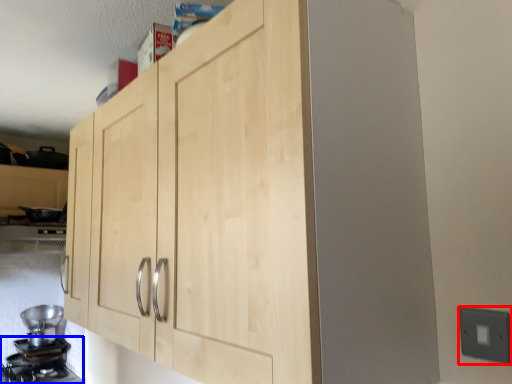
Question: Which of the following is the farthest to the observer, electric outlet (highlighted by a red box) or gas stove (highlighted by a blue box)?

Choices:
 (A) electric outlet
 (B) gas stove

Answer: (B)